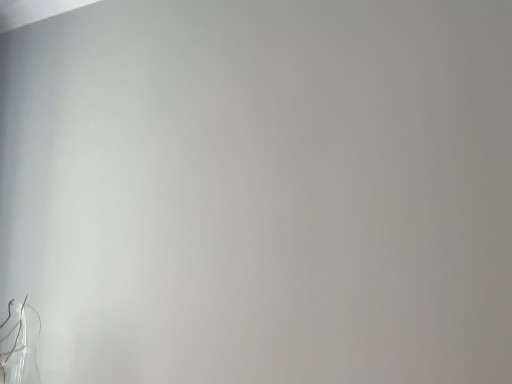
Locate an element on the screen. This screenshot has width=512, height=384. clear glass vase at lower left is located at coordinates (19, 344).

Image resolution: width=512 pixels, height=384 pixels. What do you see at coordinates (19, 344) in the screenshot?
I see `clear glass vase at lower left` at bounding box center [19, 344].

Where is `clear glass vase at lower left`? The image size is (512, 384). clear glass vase at lower left is located at coordinates (19, 344).